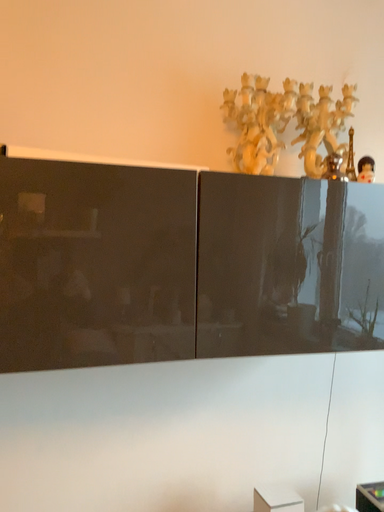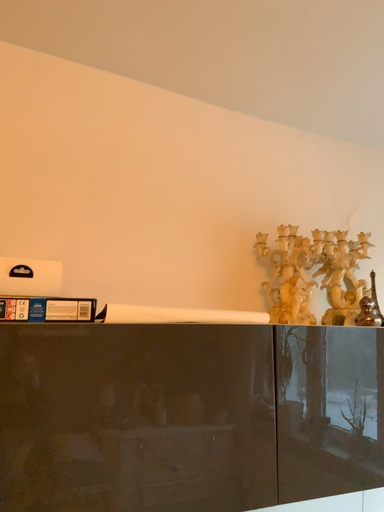
Question: Which way did the camera rotate in the video?

Choices:
 (A) rotated upward
 (B) rotated downward

Answer: (A)